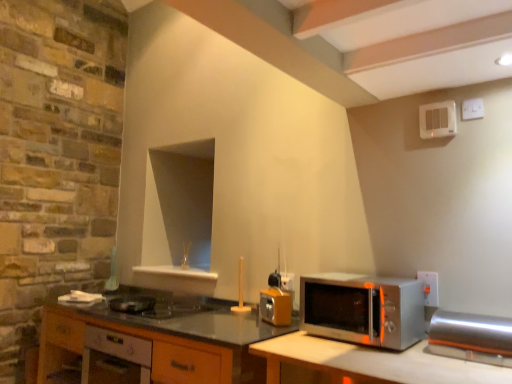
Question: Would you consider white plastic exhaust fan at upper right, acting as the 2th appliance starting from the left, to be distant from shiny metallic pan at center, positioned as the 1th appliance in back-to-front order?

Choices:
 (A) yes
 (B) no

Answer: (A)

Question: Considering the relative positions of white plastic exhaust fan at upper right, acting as the 2th appliance starting from the left, and shiny metallic pan at center, which is the third appliance in right-to-left order, in the image provided, is white plastic exhaust fan at upper right, acting as the 2th appliance starting from the left, in front of shiny metallic pan at center, which is the third appliance in right-to-left order,?

Choices:
 (A) yes
 (B) no

Answer: (A)

Question: Is white plastic exhaust fan at upper right, the first appliance from the top, wider than shiny metallic pan at center, the third appliance in the front-to-back sequence?

Choices:
 (A) yes
 (B) no

Answer: (B)

Question: Considering the relative sizes of white plastic exhaust fan at upper right, which ranks as the second appliance in front-to-back order, and shiny metallic pan at center, the first appliance in the bottom-to-top sequence, in the image provided, is white plastic exhaust fan at upper right, which ranks as the second appliance in front-to-back order, thinner than shiny metallic pan at center, the first appliance in the bottom-to-top sequence,?

Choices:
 (A) yes
 (B) no

Answer: (A)

Question: Is white plastic exhaust fan at upper right, which is counted as the 3th appliance, starting from the bottom, smaller than shiny metallic pan at center, positioned as the 1th appliance in back-to-front order?

Choices:
 (A) yes
 (B) no

Answer: (A)

Question: Is white plastic exhaust fan at upper right, the 2th appliance viewed from the back, behind shiny metallic pan at center, the third appliance in the front-to-back sequence?

Choices:
 (A) no
 (B) yes

Answer: (A)

Question: Can shiny metallic pan at center, the third appliance in the front-to-back sequence, be found inside wooden cabinet at lower left, positioned as the first cabinetry in right-to-left order?

Choices:
 (A) no
 (B) yes

Answer: (A)

Question: Is wooden cabinet at lower left, positioned as the first cabinetry in right-to-left order, taller than shiny metallic pan at center, which is counted as the third appliance, starting from the top?

Choices:
 (A) no
 (B) yes

Answer: (B)

Question: Is wooden cabinet at lower left, placed as the second cabinetry when sorted from left to right, bigger than shiny metallic pan at center, the first appliance in the bottom-to-top sequence?

Choices:
 (A) no
 (B) yes

Answer: (B)

Question: Is wooden cabinet at lower left, placed as the second cabinetry when sorted from left to right, behind shiny metallic pan at center, the first appliance in the bottom-to-top sequence?

Choices:
 (A) no
 (B) yes

Answer: (A)

Question: Is wooden cabinet at lower left, positioned as the first cabinetry in right-to-left order, wider than shiny metallic pan at center, the 1th appliance from the left?

Choices:
 (A) yes
 (B) no

Answer: (A)

Question: Does wooden cabinet at lower left, positioned as the first cabinetry in right-to-left order, have a lesser height compared to shiny metallic pan at center, positioned as the 1th appliance in back-to-front order?

Choices:
 (A) no
 (B) yes

Answer: (A)

Question: Considering the relative sizes of wooden cabinet at lower left, positioned as the first cabinetry in right-to-left order, and white plastic electric outlet at right, the first electric outlet from the front, in the image provided, is wooden cabinet at lower left, positioned as the first cabinetry in right-to-left order, smaller than white plastic electric outlet at right, the first electric outlet from the front,?

Choices:
 (A) yes
 (B) no

Answer: (B)